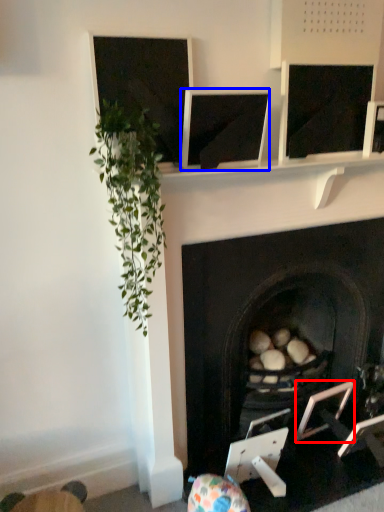
Question: Among these objects, which one is nearest to the camera, picture frame (highlighted by a red box) or computer screen (highlighted by a blue box)?

Choices:
 (A) picture frame
 (B) computer screen

Answer: (B)